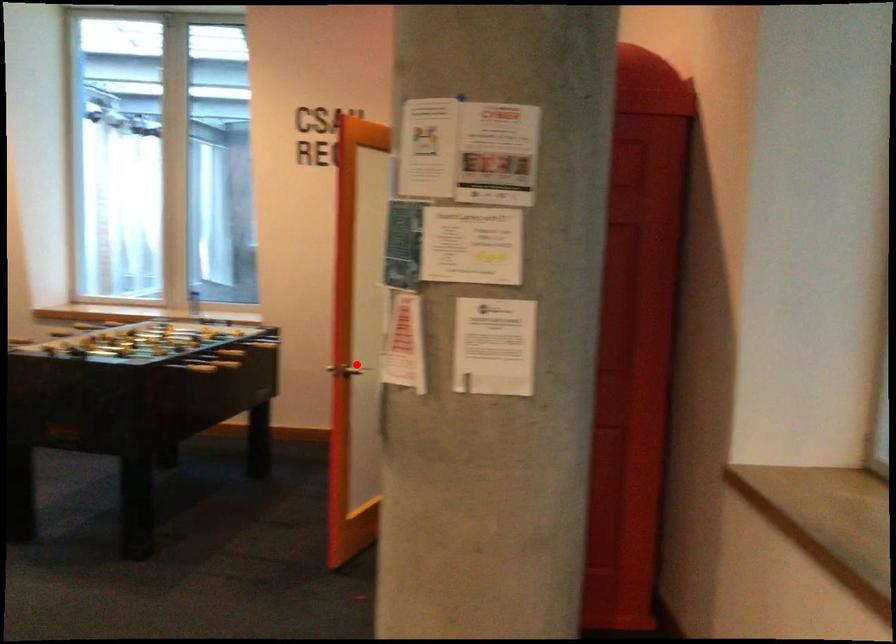
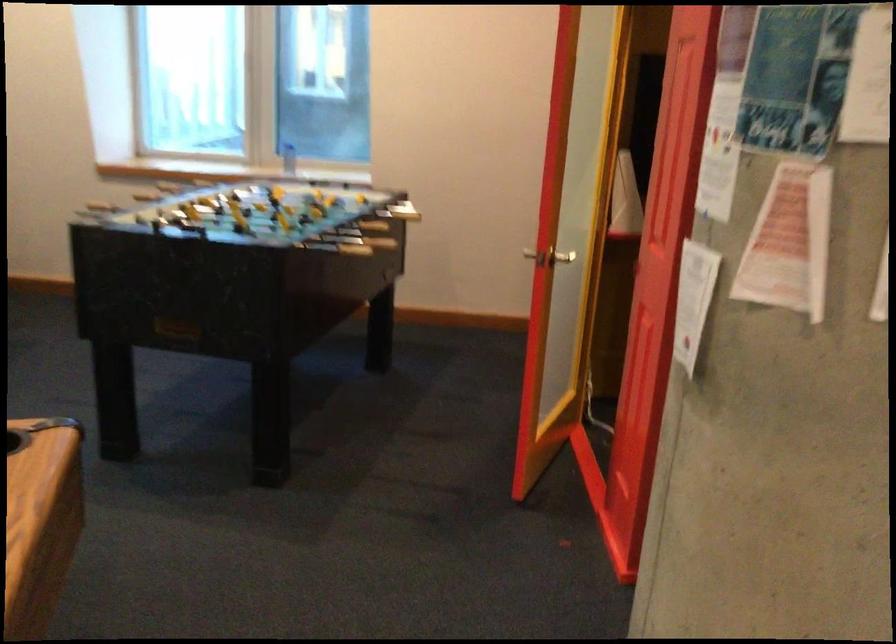
In the second image, find the point that corresponds to the highlighted location in the first image.

(562, 257)